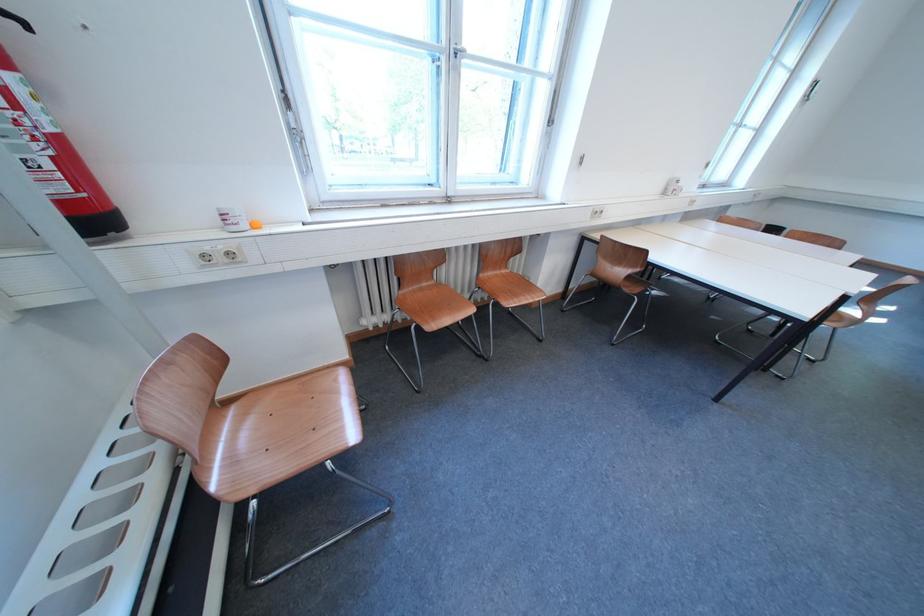
What do you see at coordinates (17, 20) in the screenshot? Image resolution: width=924 pixels, height=616 pixels. I see `the fire extinguisher lever` at bounding box center [17, 20].